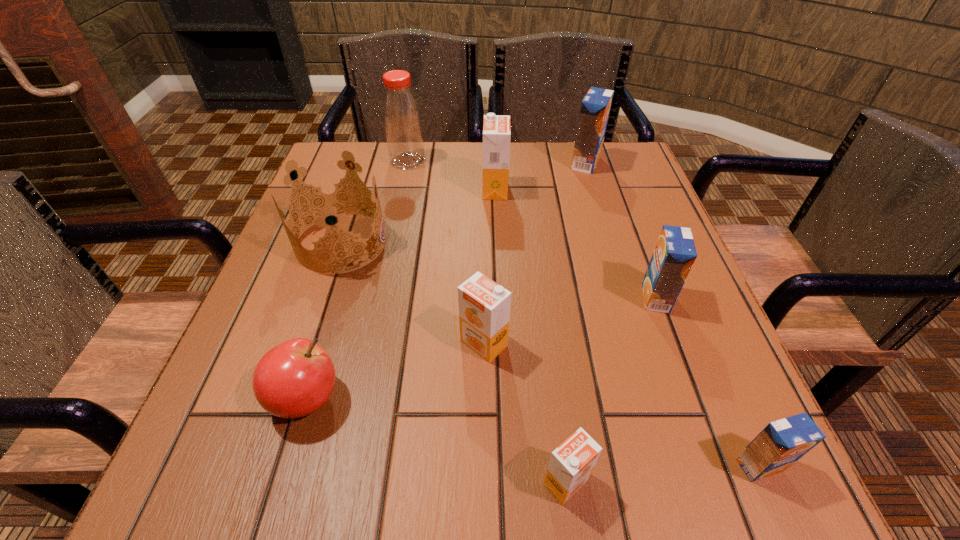
Image resolution: width=960 pixels, height=540 pixels. Identify the location of vacant area in the image that satisfies the following two spatial constraints: 1. on the front side of the sixth nearest object; 2. on the left side of the sixth farthest object. (308, 343).